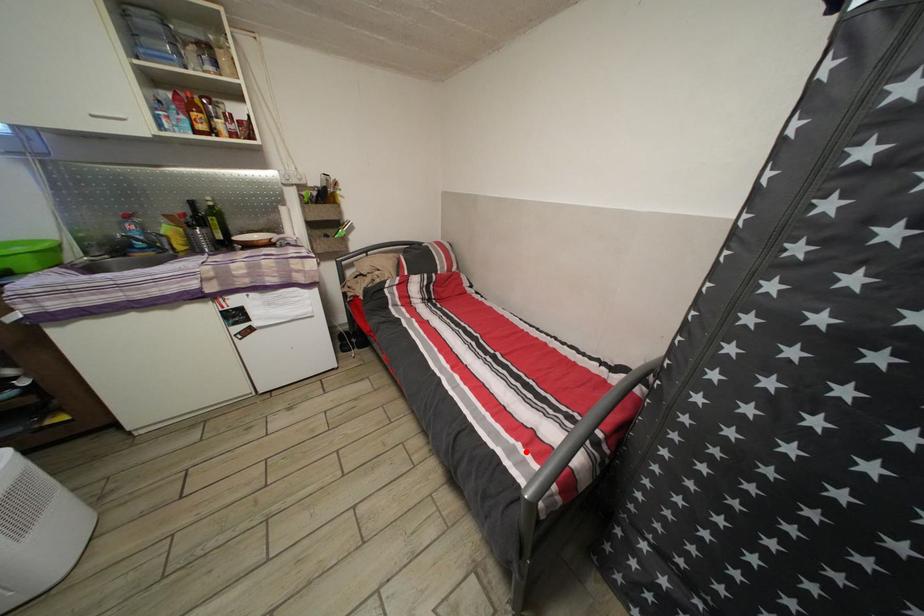
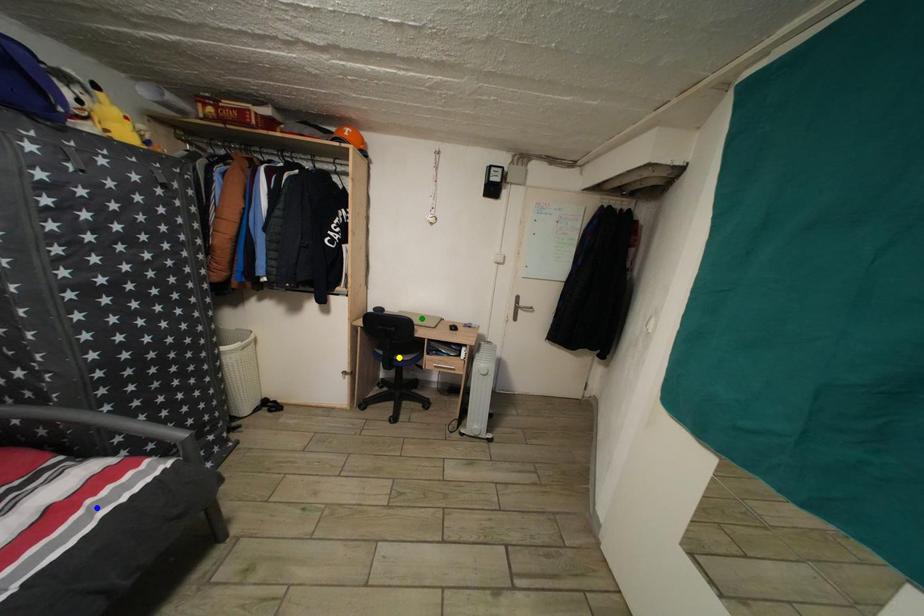
Question: I am providing you with two images of the same scene from different viewpoints. A red point is marked on the first image. You are given multiple points on the second image. Which point in image 2 represents the same 3d spot as the red point in image 1?

Choices:
 (A) blue point
 (B) green point
 (C) yellow point

Answer: (A)